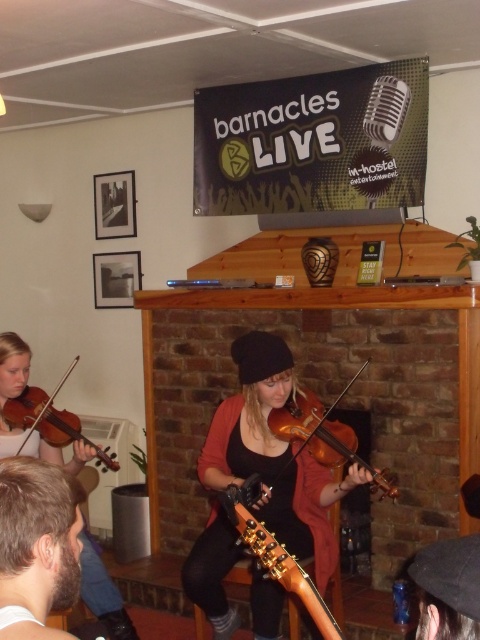
You are a photographer setting up a shot of the live music performance. You need to ensure that the bearded man at lower left and the wooden violin at center are both in frame. Given that your camera has a fixed focal length and limited field of view, which subject should you prioritize to avoid cropping the wider object?

The wooden violin at center should be prioritized as it has a greater width than the bearded man at lower left, so ensuring it fits properly will automatically accommodate the narrower bearded man at lower left within the frame.

You are a musician who wants to choose a violin that is wider for a performance. Which one between the matte brown violin at center and the matte brown violin at left should you pick?

The matte brown violin at center has a larger width than the matte brown violin at left, so you should pick the matte brown violin at center.